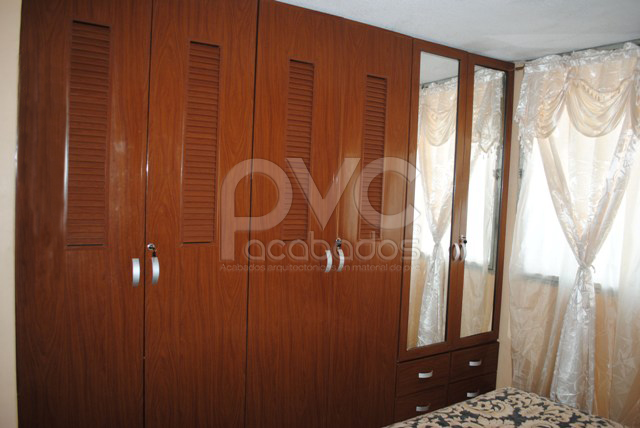
Find the location of a particular element. row of slats on cabinet/closet is located at coordinates (81, 131), (202, 117), (299, 121), (370, 121).